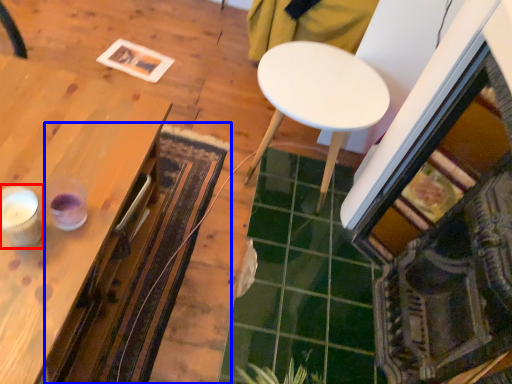
Question: Which object is further to the camera taking this photo, candle holder (highlighted by a red box) or mat (highlighted by a blue box)?

Choices:
 (A) candle holder
 (B) mat

Answer: (B)